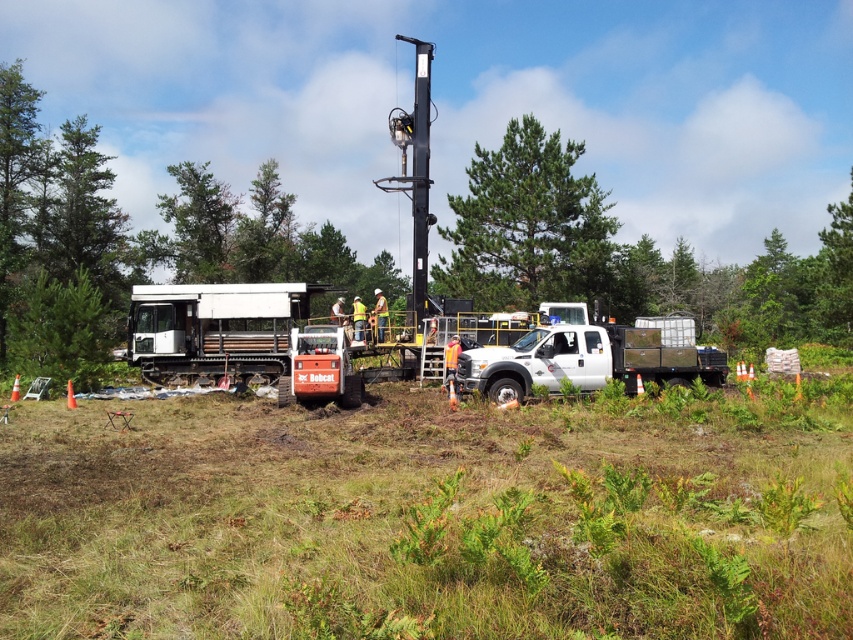
Based on the photo, does green leafy tree at center have a greater height compared to white matte truck at center?

Correct, green leafy tree at center is much taller as white matte truck at center.

Consider the image. Is green leafy tree at center closer to camera compared to white matte truck at center?

No, green leafy tree at center is behind white matte truck at center.

Based on the photo, who is more distant from viewer, (486, 266) or (511, 385)?

The point (486, 266) is behind.

What are the coordinates of `green leafy tree at center` in the screenshot? It's located at (527, 225).

Is the position of white matte truck at center more distant than that of green leafy tree at upper center?

No, white matte truck at center is closer to the viewer.

Is white matte truck at center taller than green leafy tree at upper center?

In fact, white matte truck at center may be shorter than green leafy tree at upper center.

Is point (474, 388) behind point (204, 216)?

No.

I want to click on white matte truck at center, so click(590, 358).

Between point (570, 209) and point (239, 342), which one is positioned in front?

Point (239, 342) is in front.

From the picture: Is green leafy tree at center taller than white matte trailer truck at center?

Correct, green leafy tree at center is much taller as white matte trailer truck at center.

This screenshot has width=853, height=640. Identify the location of green leafy tree at center. (527, 225).

This screenshot has height=640, width=853. Identify the location of green leafy tree at center. (527, 225).